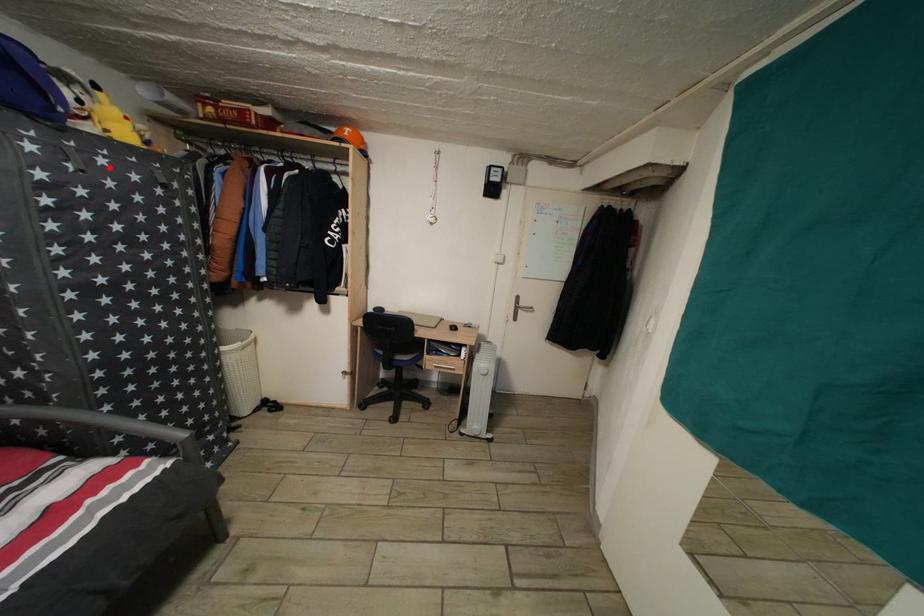
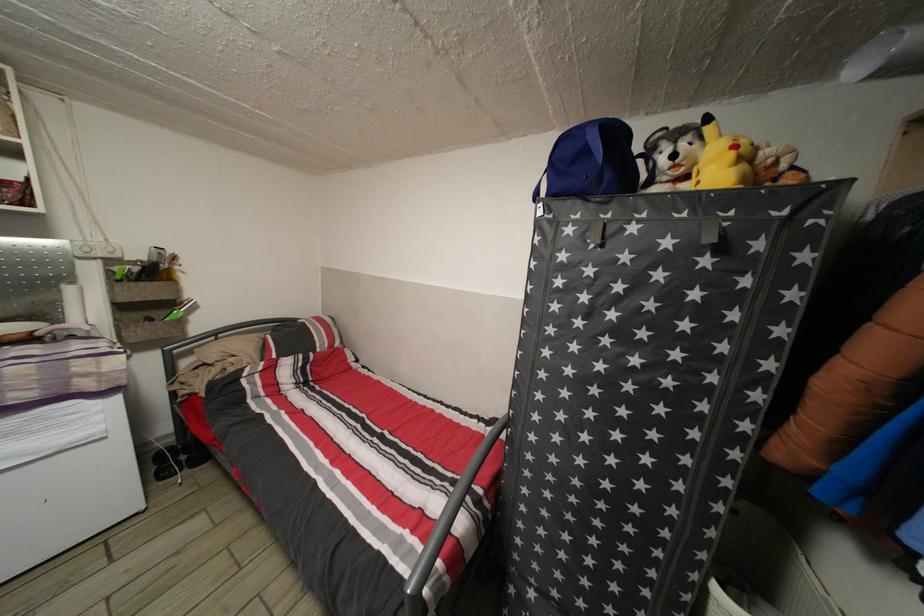
Locate, in the second image, the point that corresponds to the highlighted location in the first image.

(639, 235)